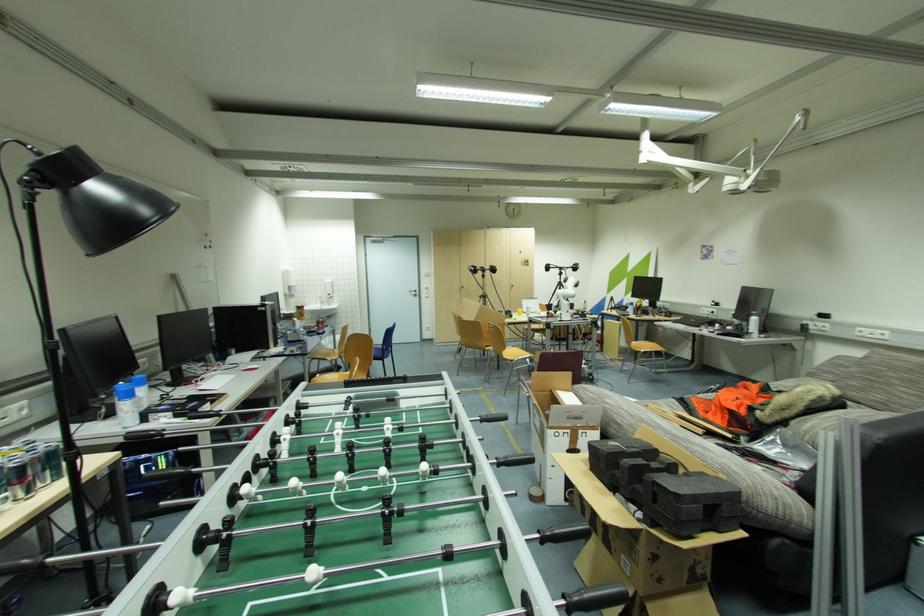
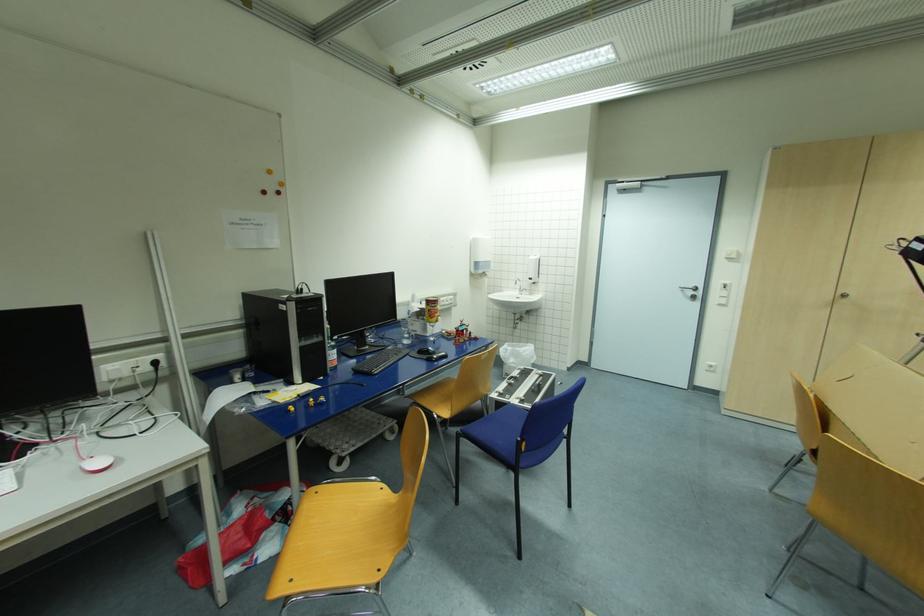
Question: I am providing you with two images of the same scene from different viewpoints. Please identify which objects are invisible in image2.

Choices:
 (A) metal door handle
 (B) yellow squeeze bottle
 (C) blue chair sitting surface
 (D) none of these

Answer: (D)